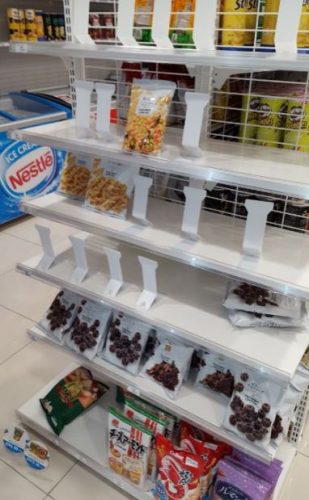
Find the location of a particular element. freezer is located at coordinates (39, 175).